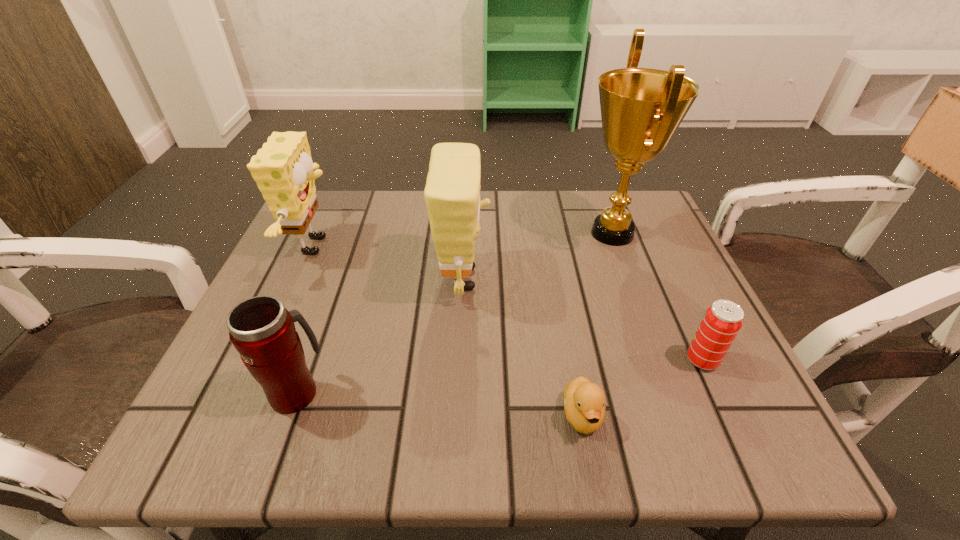
What are the coordinates of `the tallest object` in the screenshot? It's located at (641, 108).

This screenshot has height=540, width=960. I want to click on the third object from left to right, so click(x=452, y=193).

The width and height of the screenshot is (960, 540). Identify the location of the left sponge. (283, 169).

Identify the location of the third shortest object. (263, 332).

Locate an element on the screen. soda can is located at coordinates (722, 321).

This screenshot has height=540, width=960. I want to click on duckling, so click(x=584, y=402).

Where is `the shortest object`? The image size is (960, 540). the shortest object is located at coordinates (584, 402).

The image size is (960, 540). In order to click on vacant space located on the front view with handles of the award in this screenshot , I will do (x=539, y=233).

This screenshot has width=960, height=540. I want to click on vacant area situated on the front view with handles of the award, so click(460, 233).

Locate an element on the screen. This screenshot has width=960, height=540. vacant space positioned on the front view with handles of the award is located at coordinates (539, 233).